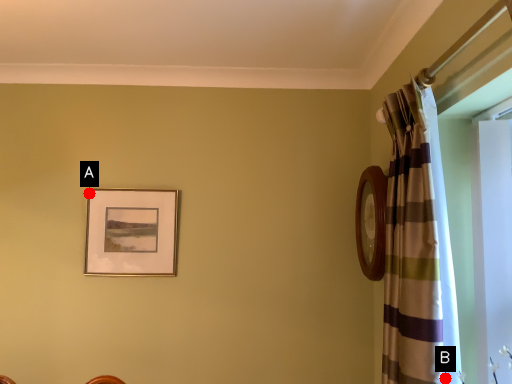
Question: Two points are circled on the image, labeled by A and B beside each circle. Which point appears farthest from the camera in this image?

Choices:
 (A) A is further
 (B) B is further

Answer: (A)